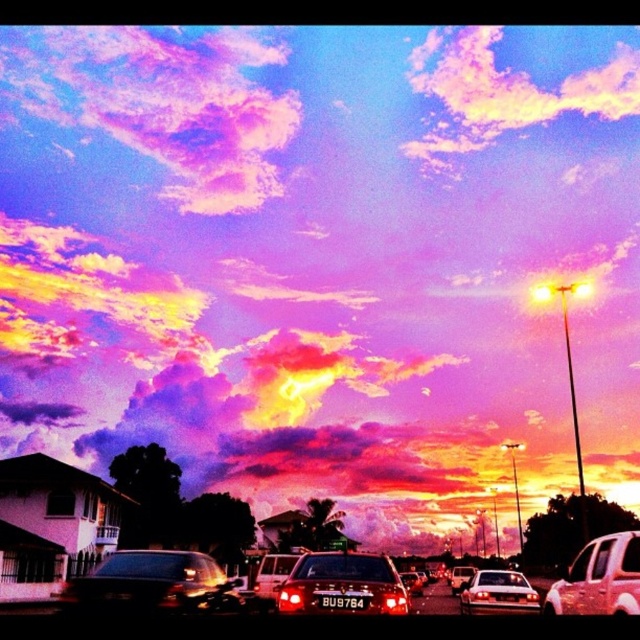
You are a delivery person trying to park your 2.5 meters wide truck between the shiny black car at center and the metallic silver car at right. According to the scene, can you fit your truck there?

The shiny black car at center might be wider than metallic silver car at right, so it is uncertain if there is enough space to fit a 2.5 meters wide truck between them.

You are a pedestrian standing at the edge of the street. You see a shiny black car at center and a metallic silver car at right. Which car is closer to you?

The shiny black car at center is closer to you because it is in front of the metallic silver car at right.

You are a drone operator trying to capture the sunset scene. You have two points marked on your screen at coordinates point (97, 611) and point (628, 600). Which point is closer to the horizon?

Point (97, 611) is behind point (628, 600), so the latter is closer to the horizon.